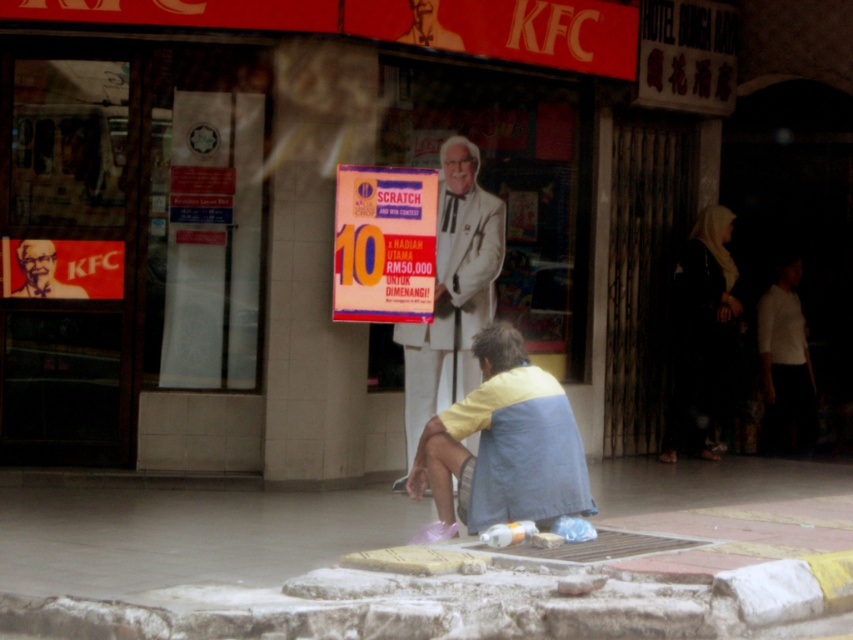
You are a photographer standing in front of the KFC restaurant. You want to take a photo of the concrete at lower center and the yellow fabric at lower center. Which object should you focus on first to ensure both are in sharp focus?

The concrete at lower center is closer to the viewer than the yellow fabric at lower center. To ensure both are in sharp focus, focus on the concrete at lower center first, as it is the closer object.

You are a delivery person who needs to place a package on the concrete at lower center. What are the coordinates where you should place the package?

The coordinates for the concrete at lower center are point (186,534).